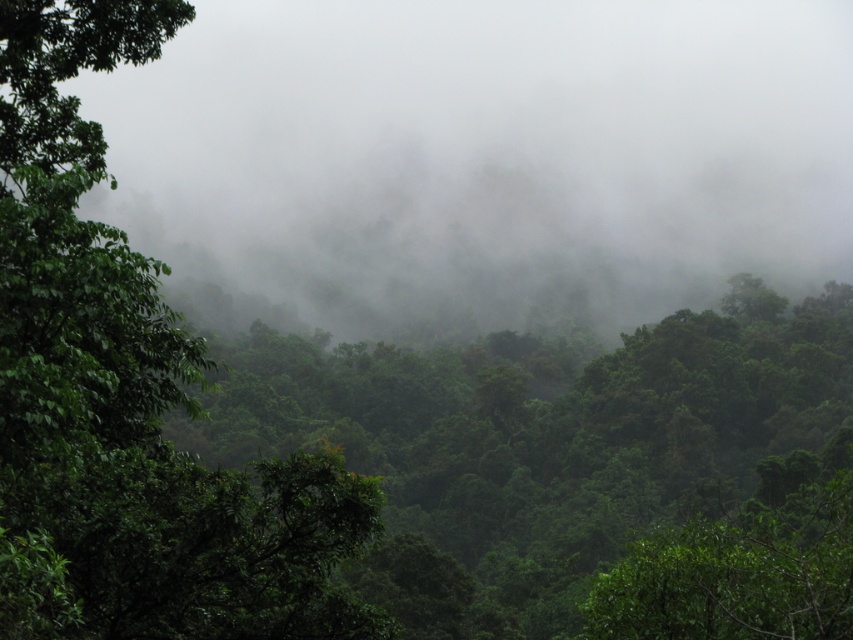
Question: Does white misty fog at upper center come behind green leafy tree at left?

Choices:
 (A) no
 (B) yes

Answer: (B)

Question: Can you confirm if white misty fog at upper center is positioned above green leafy tree at left?

Choices:
 (A) no
 (B) yes

Answer: (B)

Question: Can you confirm if white misty fog at upper center is bigger than green leafy tree at left?

Choices:
 (A) no
 (B) yes

Answer: (B)

Question: Which point is closer to the camera?

Choices:
 (A) green leafy tree at left
 (B) white misty fog at upper center

Answer: (A)